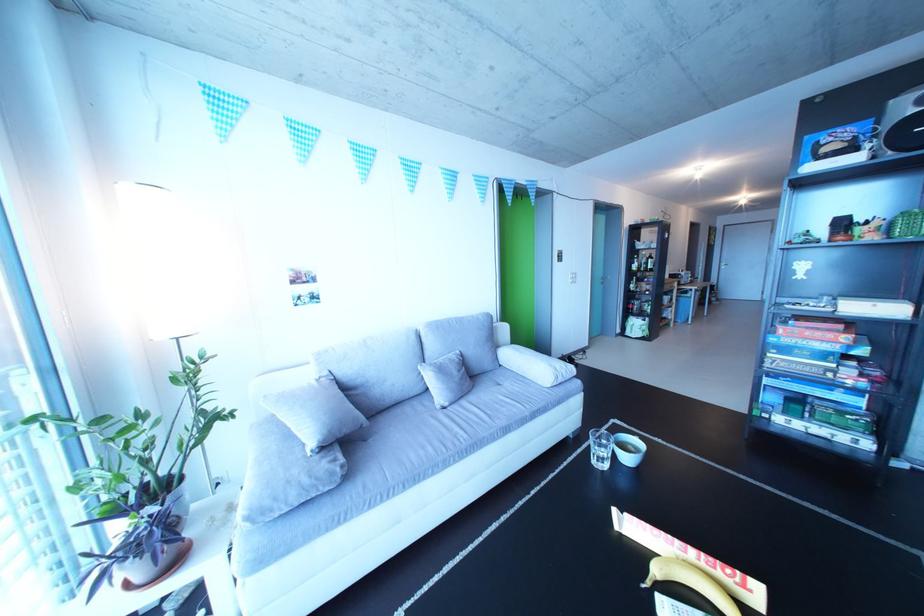
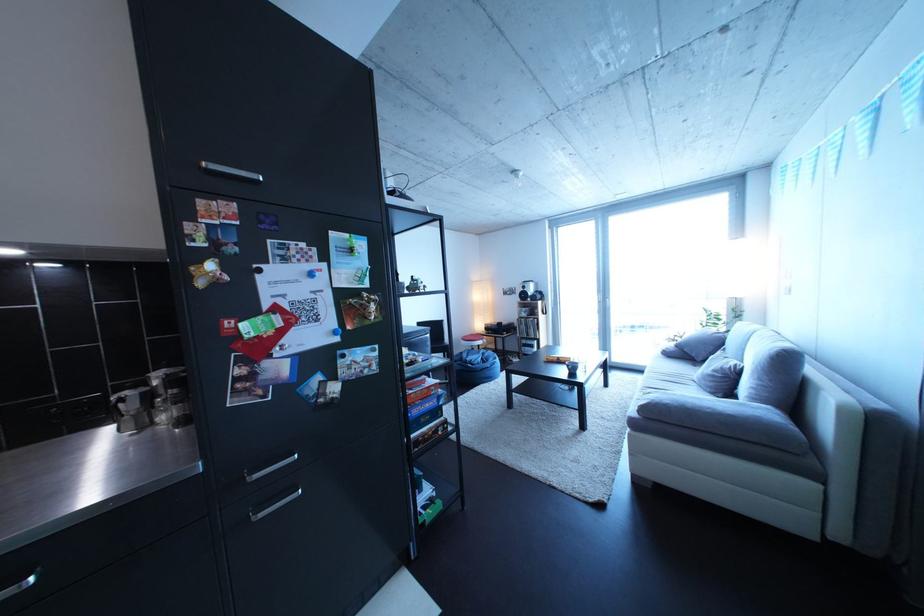
In the second image, find the point that corresponds to the point at 472,377 in the first image.

(727, 377)